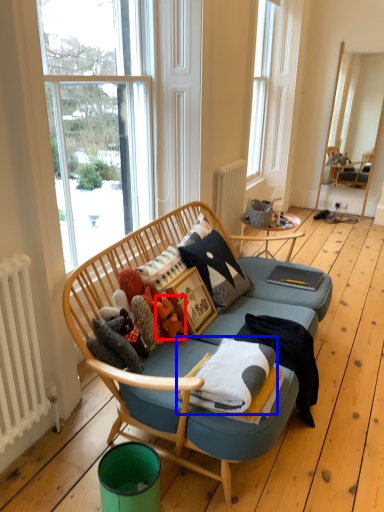
Question: Which of the following is the closest to the observer, toy (highlighted by a red box) or blanket (highlighted by a blue box)?

Choices:
 (A) toy
 (B) blanket

Answer: (B)